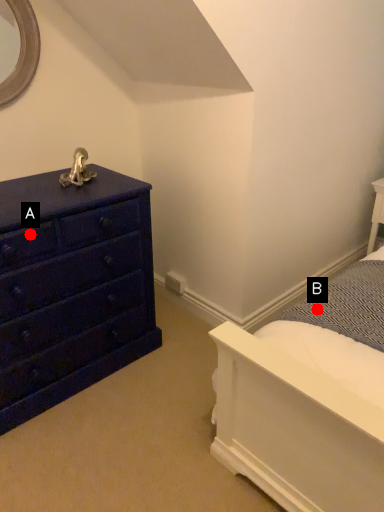
Question: Two points are circled on the image, labeled by A and B beside each circle. Which point is closer to the camera?

Choices:
 (A) A is closer
 (B) B is closer

Answer: (A)